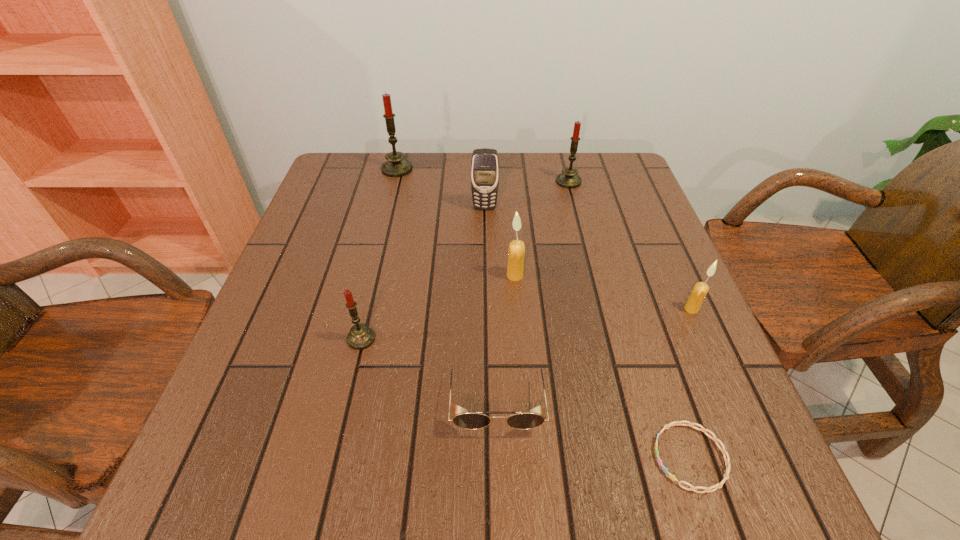
Image resolution: width=960 pixels, height=540 pixels. I want to click on vacant space that's between the blue bracelet and the sixth nearest object, so click(588, 332).

Where is `vacant space that's between the sixth farthest object and the biggest red candle`? vacant space that's between the sixth farthest object and the biggest red candle is located at coordinates (379, 254).

Where is `free point between the rightmost red candle and the third candle from right to left`? Image resolution: width=960 pixels, height=540 pixels. free point between the rightmost red candle and the third candle from right to left is located at coordinates (541, 228).

The image size is (960, 540). What are the coordinates of `free area in between the sixth farthest object and the smaller cream candle` in the screenshot? It's located at (526, 324).

The width and height of the screenshot is (960, 540). I want to click on unoccupied position between the second shortest object and the blue bracelet, so click(x=593, y=428).

Find the location of a particular element. The height and width of the screenshot is (540, 960). the fourth closest object to the second shortest object is located at coordinates [x=700, y=290].

Locate an element on the screen. The height and width of the screenshot is (540, 960). object that is the seventh closest one to the right cream candle is located at coordinates (396, 166).

I want to click on the third closest candle to the nearest candle, so click(700, 290).

The height and width of the screenshot is (540, 960). In order to click on the fourth closest candle to the right cream candle in this screenshot , I will do `click(396, 166)`.

Locate an element on the screen. This screenshot has width=960, height=540. the second closest red candle to the right cream candle is located at coordinates (360, 337).